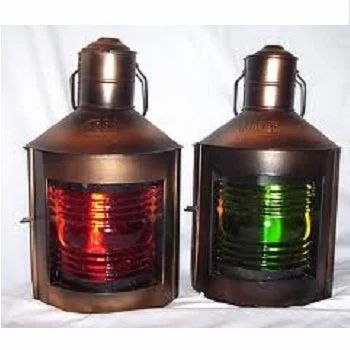
This screenshot has width=350, height=350. I want to click on right handle, so click(x=144, y=88).